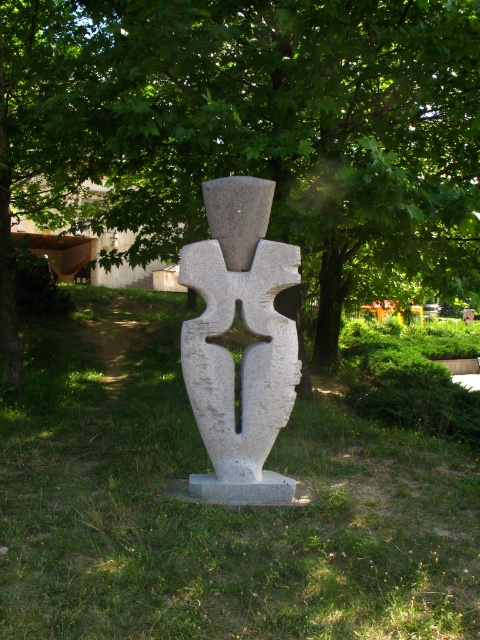
Question: Considering the relative positions of green leafy tree at center and green grass at center in the image provided, where is green leafy tree at center located with respect to green grass at center?

Choices:
 (A) left
 (B) right

Answer: (B)

Question: Among these points, which one is farthest from the camera?

Choices:
 (A) (96, 156)
 (B) (128, 632)

Answer: (A)

Question: Is green grass at center further to camera compared to white stone sculpture at center?

Choices:
 (A) no
 (B) yes

Answer: (B)

Question: Estimate the real-world distances between objects in this image. Which object is farther from the green grass at center?

Choices:
 (A) green leafy tree at center
 (B) white stone sculpture at center

Answer: (A)

Question: Which point is closer to the camera taking this photo?

Choices:
 (A) (40, 480)
 (B) (278, 400)

Answer: (B)

Question: Does green grass at center come behind white stone sculpture at center?

Choices:
 (A) no
 (B) yes

Answer: (B)